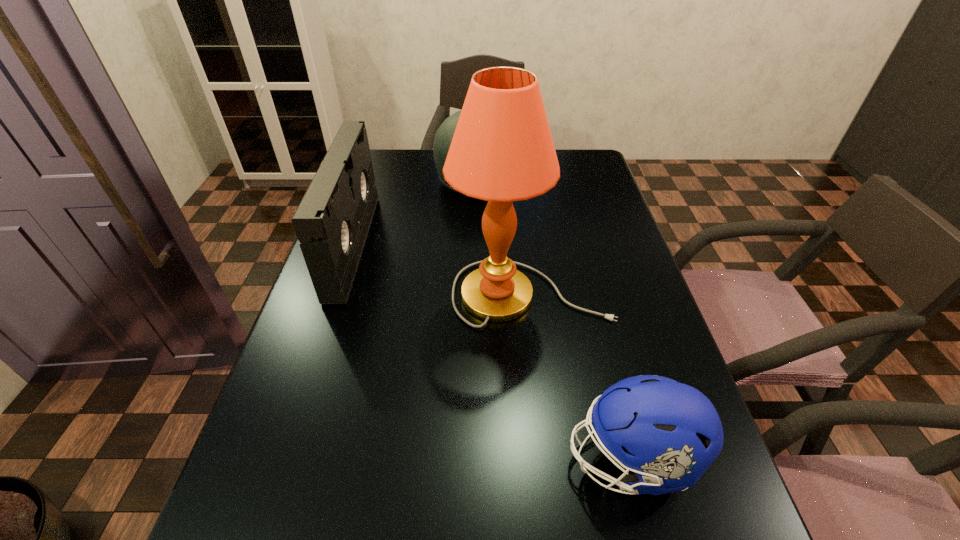
The height and width of the screenshot is (540, 960). I want to click on vacant space that satisfies the following two spatial constraints: 1. on the side of the tallest object with visible spindles; 2. on the left side of the leftmost object, so click(x=337, y=294).

Image resolution: width=960 pixels, height=540 pixels. In order to click on free space that satisfies the following two spatial constraints: 1. at the face opening of the taller football helmet; 2. on the right side of the tallest object in this screenshot , I will do click(x=470, y=294).

The image size is (960, 540). In order to click on vacant point that satisfies the following two spatial constraints: 1. at the face opening of the lamp; 2. on the left side of the farther football helmet in this screenshot , I will do `click(470, 294)`.

Identify the location of free location that satisfies the following two spatial constraints: 1. at the face opening of the left football helmet; 2. on the right side of the lamp. This screenshot has height=540, width=960. (470, 294).

You are a GUI agent. You are given a task and a screenshot of the screen. Output one action in this format:
    pyautogui.click(x=<x>, y=<y>)
    Task: Click on the vacant point that satisfies the following two spatial constraints: 1. at the face opening of the taller football helmet; 2. on the left side of the tallest object
    
    Given the screenshot: What is the action you would take?
    pyautogui.click(x=470, y=294)